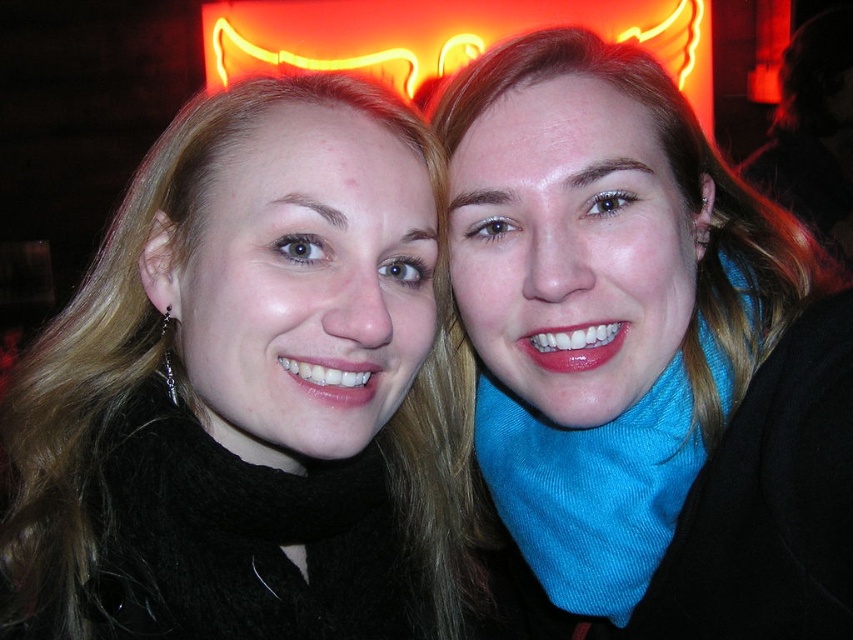
You are a photographer adjusting the camera focus. You need to ensure both the black fuzzy scarf at upper center and the blue corduroy scarf at right are in focus. Given their sizes, which scarf might require you to adjust the focus more carefully?

The blue corduroy scarf at right is smaller in size compared to the black fuzzy scarf at upper center, so it might require more careful focus adjustment to ensure clarity.

You are a photographer trying to capture a closeup shot of both blue corduroy scarves. The camera you are using has a maximum focus range of 25 centimeters. Can you fit both blue corduroy scarf at center and blue corduroy scarf at right in the frame without moving the camera?

The blue corduroy scarf at center and blue corduroy scarf at right are 27.30 centimeters apart. Since the camera has a maximum focus range of 25 centimeters, the distance between them exceeds the camera capabilities. Therefore, you cannot fit both blue corduroy scarf at center and blue corduroy scarf at right in the frame without moving the camera.